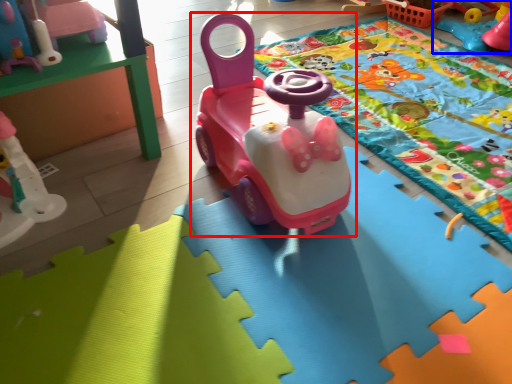
Question: Which object appears closest to the camera in this image, toy (highlighted by a red box) or toy (highlighted by a blue box)?

Choices:
 (A) toy
 (B) toy

Answer: (A)